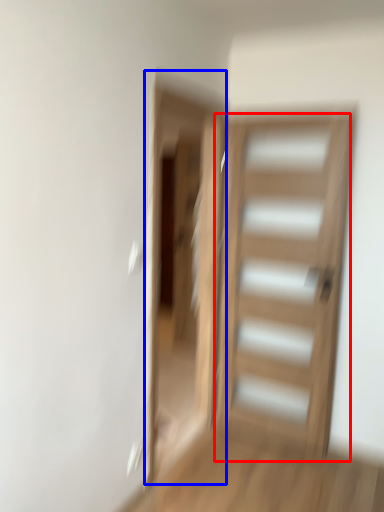
Question: Which object appears closest to the camera in this image, door (highlighted by a red box) or screen door (highlighted by a blue box)?

Choices:
 (A) door
 (B) screen door

Answer: (B)